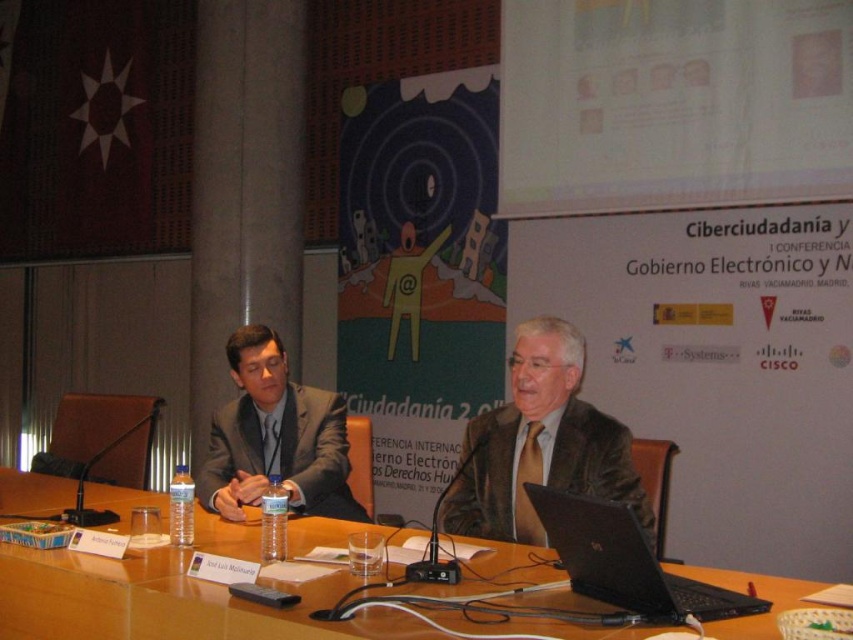
You are attending a conference and need to move from the wooden table at center to the gray concrete pillar at center. Which direction should you move to reach the pillar?

The wooden table at center is positioned on the right side of the gray concrete pillar at center, so you should move to the left to reach the pillar.

You are a stagehand preparing to place a 3.5 meter long banner between the gray concrete pillar at center and the brown leather jacket at center. Can the banner fit horizontally between them?

The distance between the gray concrete pillar at center and the brown leather jacket at center is 2.78 meters. Since the banner is 3.5 meters long, which is longer than the available space, the banner cannot fit horizontally between them.

You are attending a virtual meeting and need to present a slide. The wooden table at center has your notes, while the black plastic laptop at center is your presentation device. To ensure your audience can see your slides clearly, which object should you position closer to the camera?

The black plastic laptop at center should be positioned closer to the camera since the wooden table at center is in front of it, blocking the view.